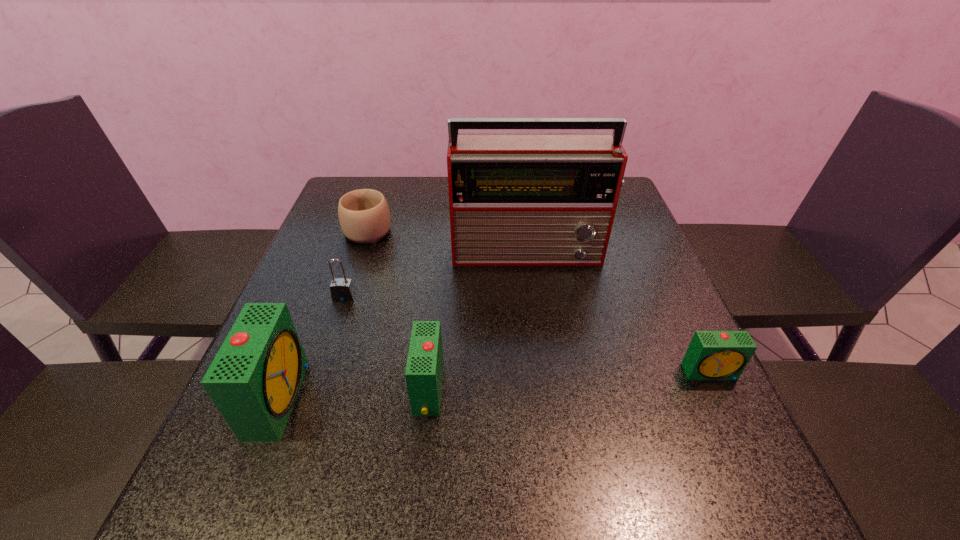
At what (x,y) coordinates should I click in order to perform the action: click on free spot that satisfies the following two spatial constraints: 1. on the shackle of the fourth nearest object; 2. on the front-facing side of the fifth shortest object. Please return your answer as a coordinate pair (x, y). The width and height of the screenshot is (960, 540). Looking at the image, I should click on (310, 398).

I want to click on vacant region that satisfies the following two spatial constraints: 1. on the front-facing side of the fifth object from left to right; 2. on the front-facing side of the fourth object from left to right, so click(x=549, y=389).

In order to click on vacant space that satisfies the following two spatial constraints: 1. on the front-facing side of the shortest alarm clock; 2. on the front-facing side of the leftmost alarm clock in this screenshot , I will do `click(723, 398)`.